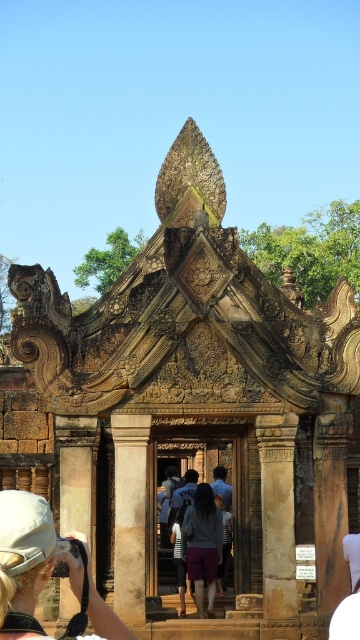
Can you confirm if dark gray fabric skirt at center is thinner than purple cotton shorts at center?

In fact, dark gray fabric skirt at center might be wider than purple cotton shorts at center.

Is dark gray fabric skirt at center to the left of purple cotton shorts at center from the viewer's perspective?

Correct, you'll find dark gray fabric skirt at center to the left of purple cotton shorts at center.

This screenshot has height=640, width=360. Describe the element at coordinates (201, 545) in the screenshot. I see `dark gray fabric skirt at center` at that location.

This screenshot has height=640, width=360. Identify the location of dark gray fabric skirt at center. pos(201,545).

Is brown stone column at center to the right of dark gray fabric skirt at center from the viewer's perspective?

Correct, you'll find brown stone column at center to the right of dark gray fabric skirt at center.

This screenshot has height=640, width=360. In order to click on brown stone column at center in this screenshot , I will do `click(277, 525)`.

The width and height of the screenshot is (360, 640). Describe the element at coordinates (277, 525) in the screenshot. I see `brown stone column at center` at that location.

Image resolution: width=360 pixels, height=640 pixels. I want to click on brown stone column at center, so click(277, 525).

Which is more to the right, white fabric at center or brown stone column at center?

From the viewer's perspective, brown stone column at center appears more on the right side.

Who is lower down, white fabric at center or brown stone column at center?

brown stone column at center is below.

Measure the distance between point (29, 573) and camera.

A distance of 67.72 meters exists between point (29, 573) and camera.

Where is `white fabric at center`? The height and width of the screenshot is (640, 360). white fabric at center is located at coordinates (42, 570).